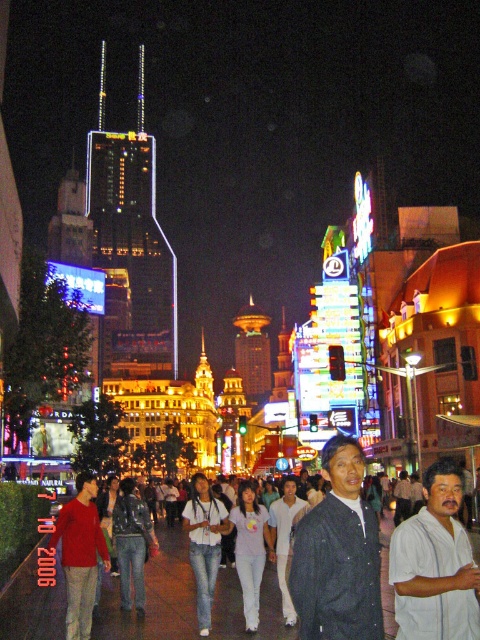
You are standing in the middle of the bustling urban scene and want to reach a specific location. You have two points to choose from. Which point is closer to you, point (373, 605) or point (91, 568)?

Point (373, 605) is closer to the viewer than point (91, 568), so you should choose point (373, 605) as it is nearer to your current position.

You are a photographer standing on the street in the scene. You notice two people wearing the dark blue denim shirt at center and the white cotton shirt at lower right. Which person is positioned higher up in the frame?

The dark blue denim shirt at center is located above the white cotton shirt at lower right, so the person wearing the dark blue denim shirt at center is positioned higher up in the frame.

You are a photographer standing in the bustling urban scene at night. You notice two people wearing a dark blue denim shirt at center and a matte red sweater at center. Which clothing item is positioned closer to you?

The dark blue denim shirt at center is closer to the viewer than the matte red sweater at center.